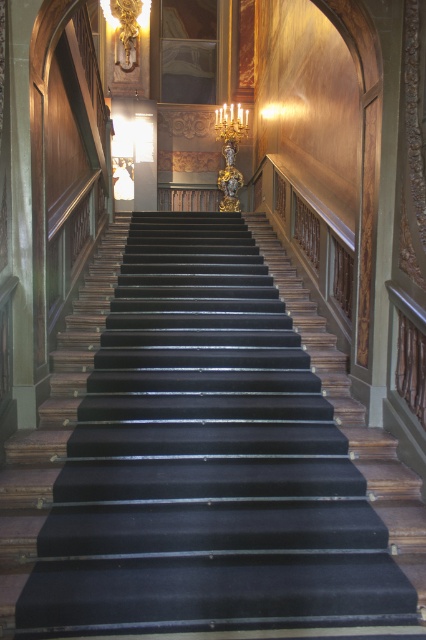
You are standing at the entrance of the grand staircase and want to reach the landing area. Which direction should you move relative to the black velvet stairs at center to reach the landing?

To reach the landing area, you should move upwards along the black velvet stairs at center since the stairs lead upwards into a dimly lit area as described in the scene.

Based on the photo, you are standing at the base of the staircase in the image. There is a point marked at coordinates point (164, 369). Can you reach this point without moving past the first step?

The distance between point (164, 369) and the viewer is 14.14 feet, so you cannot reach it without moving past the first step.

You are standing at the bottom of the staircase and notice a specific point marked at coordinates (193, 465). Can you identify which part of the staircase this point corresponds to?

The point (193, 465) corresponds to the black velvet stairs at center.